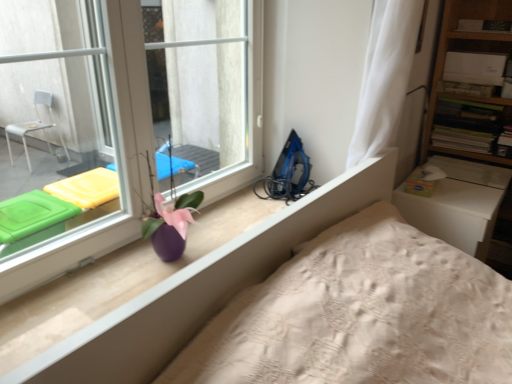
Question: Does purple glossy vase at center have a greater width compared to wooden bookshelf at upper right?

Choices:
 (A) no
 (B) yes

Answer: (A)

Question: Could you tell me if purple glossy vase at center is facing wooden bookshelf at upper right?

Choices:
 (A) yes
 (B) no

Answer: (B)

Question: Is purple glossy vase at center in front of wooden bookshelf at upper right?

Choices:
 (A) yes
 (B) no

Answer: (A)

Question: Considering the relative sizes of purple glossy vase at center and wooden bookshelf at upper right in the image provided, is purple glossy vase at center smaller than wooden bookshelf at upper right?

Choices:
 (A) yes
 (B) no

Answer: (B)

Question: Considering the relative positions of purple glossy vase at center and wooden bookshelf at upper right in the image provided, is purple glossy vase at center behind wooden bookshelf at upper right?

Choices:
 (A) no
 (B) yes

Answer: (A)

Question: From the image's perspective, is blue plastic iron at right above or below wooden bookshelf at upper right?

Choices:
 (A) above
 (B) below

Answer: (B)

Question: Is blue plastic iron at right spatially inside wooden bookshelf at upper right, or outside of it?

Choices:
 (A) inside
 (B) outside

Answer: (B)

Question: In the image, is blue plastic iron at right positioned in front of or behind wooden bookshelf at upper right?

Choices:
 (A) front
 (B) behind

Answer: (A)

Question: In terms of size, does blue plastic iron at right appear bigger or smaller than wooden bookshelf at upper right?

Choices:
 (A) big
 (B) small

Answer: (B)

Question: From the image's perspective, is purple glossy vase at center positioned above or below blue plastic iron at right?

Choices:
 (A) below
 (B) above

Answer: (A)

Question: Looking at the image, does purple glossy vase at center seem bigger or smaller compared to blue plastic iron at right?

Choices:
 (A) small
 (B) big

Answer: (B)

Question: In terms of width, does purple glossy vase at center look wider or thinner when compared to blue plastic iron at right?

Choices:
 (A) wide
 (B) thin

Answer: (B)

Question: From a real-world perspective, is purple glossy vase at center physically located above or below blue plastic iron at right?

Choices:
 (A) above
 (B) below

Answer: (A)

Question: Is transparent glass window at upper left to the left or to the right of wooden bookshelf at upper right in the image?

Choices:
 (A) right
 (B) left

Answer: (B)

Question: From the image's perspective, is transparent glass window at upper left located above or below wooden bookshelf at upper right?

Choices:
 (A) above
 (B) below

Answer: (B)